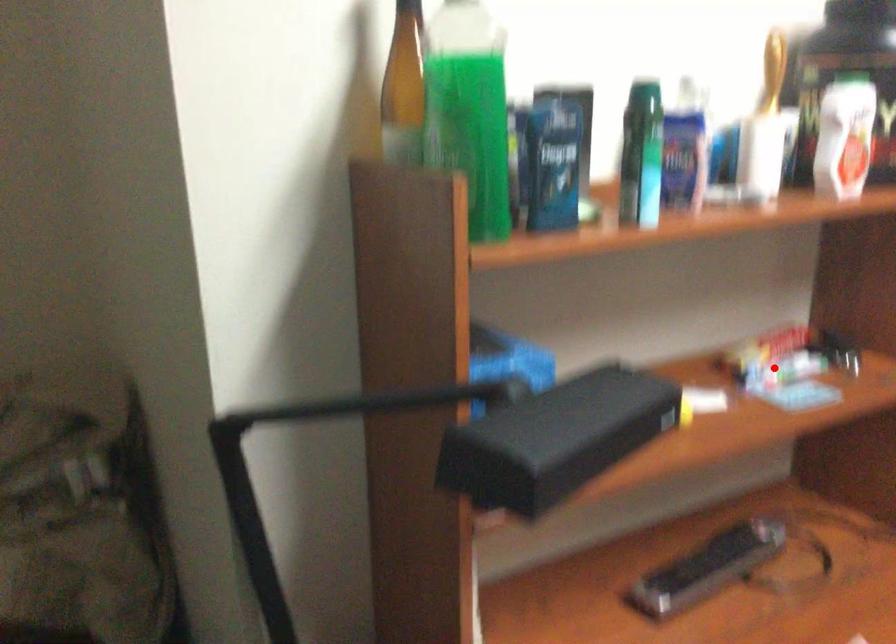
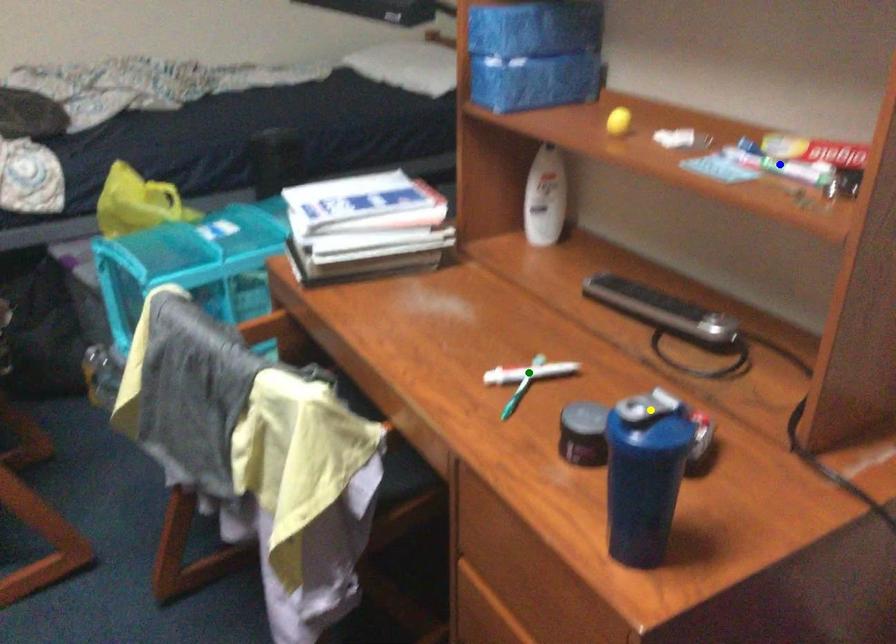
Question: I am providing you with two images of the same scene from different viewpoints. A red point is marked on the first image. You are given multiple points on the second image. In image 2, which mark is for the same physical point as the one in image 1?

Choices:
 (A) blue point
 (B) green point
 (C) yellow point

Answer: (A)